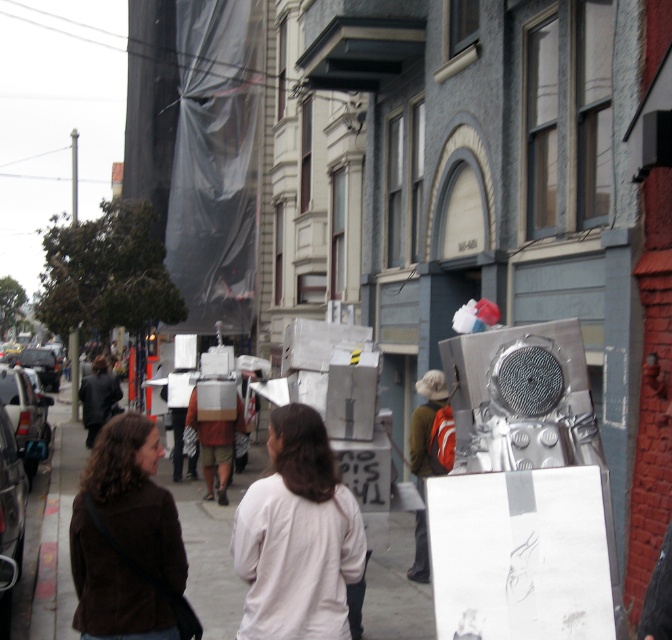
Consider the image. You are a photographer positioned at the back of the crowd in this street scene. You want to take a clear photo of the white matte shirt at center and the metallic silver backpack at center. Which object will appear larger in your photo?

The white matte shirt at center will appear larger in the photo because it is closer to the viewer than the metallic silver backpack at center.

You are a delivery person with a cart that is 1.2 meters wide. You need to move from the suede brown jacket at lower left to the smooth concrete sidewalk at center. Is there enough space for your cart to pass through the area between them?

The distance between the suede brown jacket at lower left and the smooth concrete sidewalk at center is 7.33 meters. Since your cart is only 1.2 meters wide, there is ample space for it to pass through the area between them.